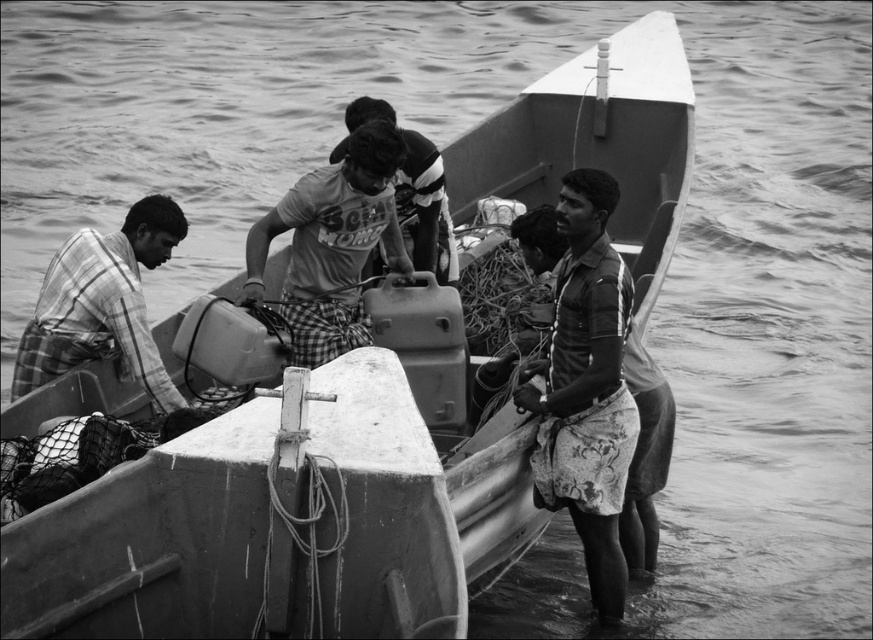
Question: Observing the image, what is the correct spatial positioning of checkered fabric shirt at center in reference to checkered fabric shirt at left?

Choices:
 (A) above
 (B) below

Answer: (A)

Question: Is checkered fabric shirt at center bigger than checkered fabric shirt at left?

Choices:
 (A) no
 (B) yes

Answer: (B)

Question: Is checkered fabric shirt at center smaller than dark fabric sarong at lower right?

Choices:
 (A) yes
 (B) no

Answer: (A)

Question: Among these objects, which one is farthest from the camera?

Choices:
 (A) checkered fabric shirt at center
 (B) dark fabric sarong at lower right
 (C) matte gray shirt at center

Answer: (C)

Question: Which point appears closest to the camera in this image?

Choices:
 (A) (248, 285)
 (B) (643, 561)
 (C) (406, 161)

Answer: (A)

Question: Which object appears farthest from the camera in this image?

Choices:
 (A) checkered fabric shirt at center
 (B) dark fabric sarong at lower right
 (C) matte gray shirt at center
 (D) checkered fabric shirt at left

Answer: (C)